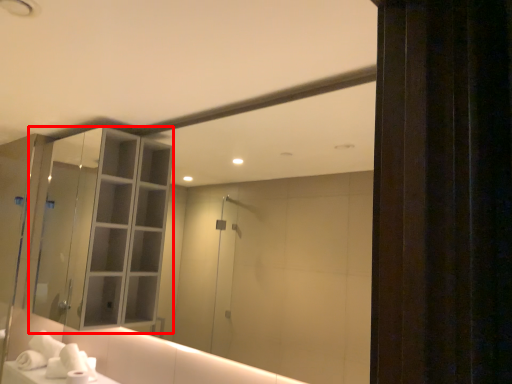
Question: Where is cabinetry (annotated by the red box) located in relation to hand towel in the image?

Choices:
 (A) right
 (B) left

Answer: (B)